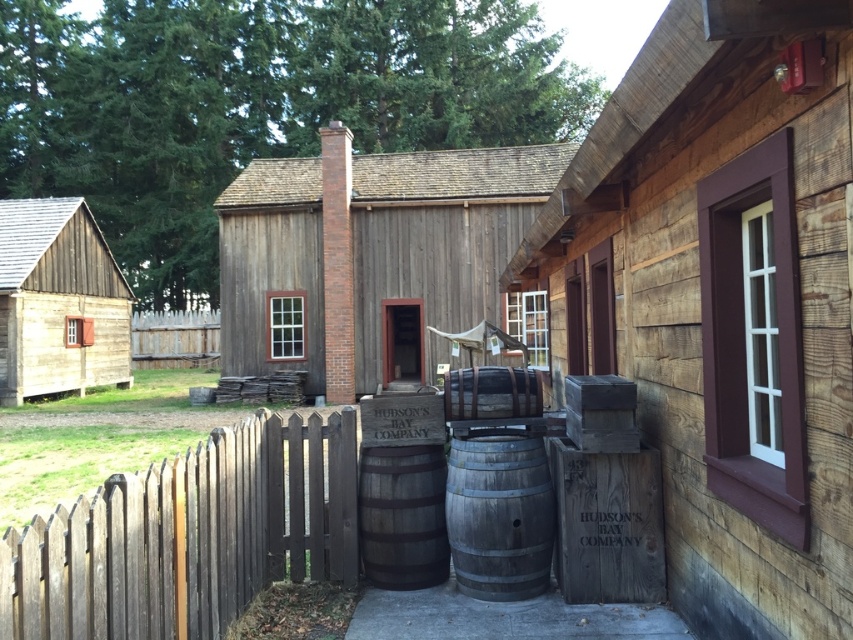
You are a visitor standing at the entrance of the museum. You see the wooden cabin at center and the rustic wooden barrel at center. Which object is positioned higher in the image?

The wooden cabin at center is located above the rustic wooden barrel at center, so it is positioned higher in the image.

You are an architect visiting this historical site. You need to determine which object, the wooden cabin at center or the rustic wooden barrel at center, would require more materials to construct based on their sizes. Which one would it be?

The wooden cabin at center is bigger than the rustic wooden barrel at center, so it would require more materials to construct.